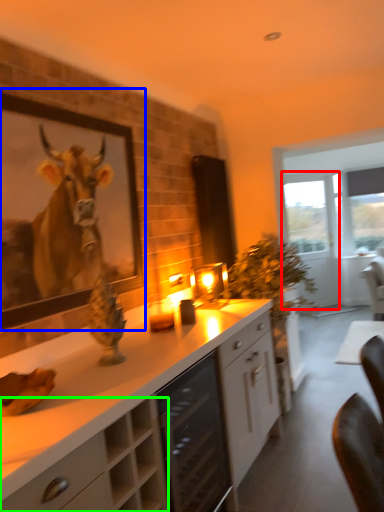
Question: Based on their relative distances, which object is nearer to glass door (highlighted by a red box)? Choose from picture frame (highlighted by a blue box) and cabinetry (highlighted by a green box).

Choices:
 (A) picture frame
 (B) cabinetry

Answer: (A)